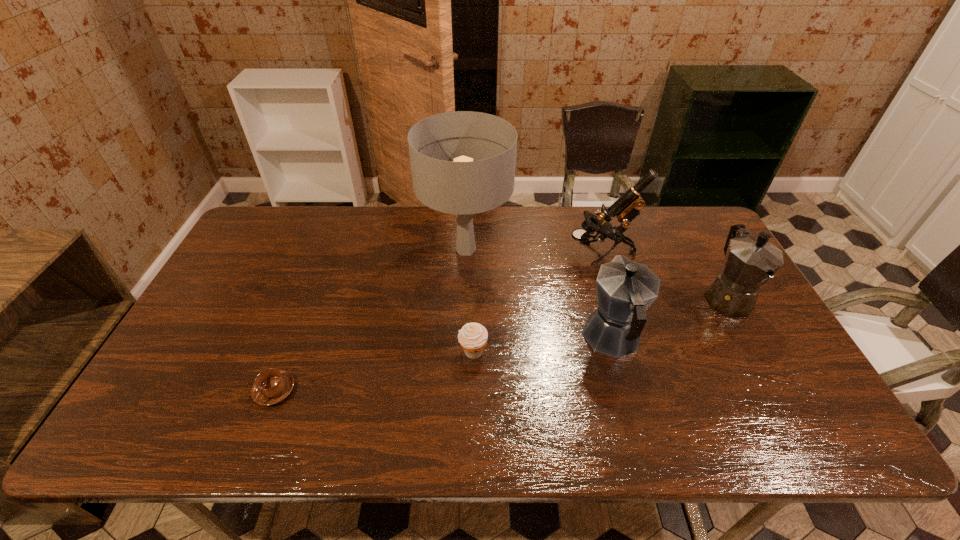
The image size is (960, 540). What are the coordinates of `lampshade` in the screenshot? It's located at (463, 187).

Where is `the fifth shortest object`? This screenshot has height=540, width=960. the fifth shortest object is located at coordinates (627, 207).

Identify the location of the left coffeepot. (625, 289).

This screenshot has width=960, height=540. What are the coordinates of `the right coffeepot` in the screenshot? It's located at (750, 262).

This screenshot has width=960, height=540. I want to click on the second shortest object, so click(472, 337).

This screenshot has width=960, height=540. What are the coordinates of `cappuccino` in the screenshot? It's located at (271, 386).

Identify the location of the leftmost object. This screenshot has height=540, width=960. (271, 386).

At what (x,y) coordinates should I click in order to perform the action: click on vacant space located on the front-facing side of the lampshade. Please return your answer as a coordinate pair (x, y). The height and width of the screenshot is (540, 960). Looking at the image, I should click on 553,249.

At what (x,y) coordinates should I click in order to perform the action: click on vacant space located 0.300m through the eyepiece of the microscope. Please return your answer as a coordinate pair (x, y). The image size is (960, 540). Looking at the image, I should click on (475, 253).

Locate an element on the screen. The height and width of the screenshot is (540, 960). free region located through the eyepiece of the microscope is located at coordinates (472, 253).